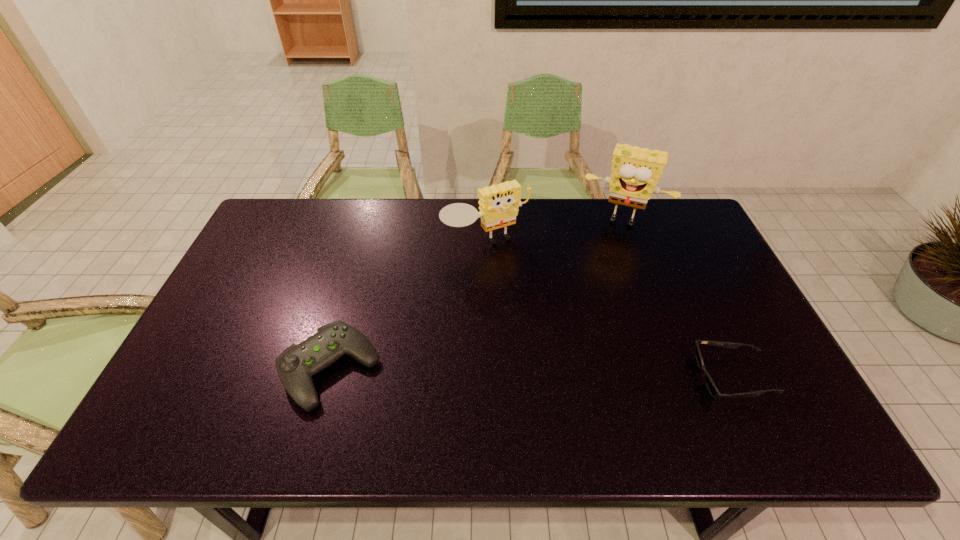
This screenshot has height=540, width=960. I want to click on blank space located 0.320m on the front-facing side of the shortest object, so click(564, 377).

Where is `free space located 0.380m on the front-facing side of the second tallest object`? The height and width of the screenshot is (540, 960). free space located 0.380m on the front-facing side of the second tallest object is located at coordinates (573, 352).

Image resolution: width=960 pixels, height=540 pixels. What are the coordinates of `vacant region located 0.360m on the front-facing side of the second tallest object` in the screenshot? It's located at click(x=568, y=346).

This screenshot has width=960, height=540. What are the coordinates of `free space located 0.370m on the front-facing side of the second tallest object` in the screenshot? It's located at (570, 349).

Find the location of a particular element. vacant point located 0.140m on the front-facing side of the right sponge is located at coordinates (602, 259).

Locate an element on the screen. vacant region located 0.120m on the front-facing side of the right sponge is located at coordinates (604, 255).

The width and height of the screenshot is (960, 540). Identify the location of free space located 0.160m on the front-facing side of the right sponge. (601, 264).

Find the location of a particular element. The height and width of the screenshot is (540, 960). control that is at the near edge is located at coordinates (296, 365).

Locate an element on the screen. The image size is (960, 540). sunglasses located in the near edge section of the desktop is located at coordinates (711, 386).

Where is `sunglasses at the right edge`? This screenshot has width=960, height=540. sunglasses at the right edge is located at coordinates (711, 386).